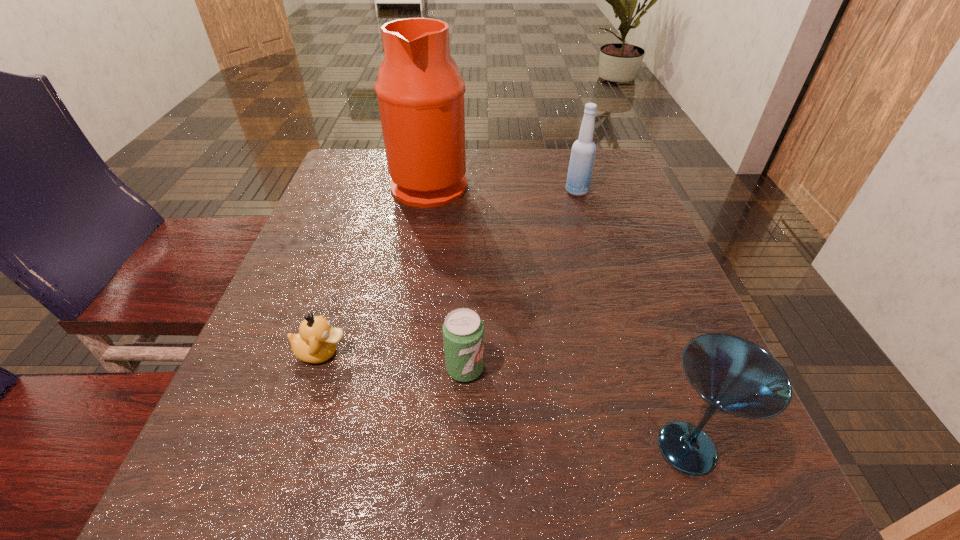
Image resolution: width=960 pixels, height=540 pixels. I want to click on free space located on the face of the shortest object, so click(x=385, y=352).

The height and width of the screenshot is (540, 960). In order to click on water jug that is at the far edge in this screenshot , I will do `click(420, 92)`.

Where is `bottle that is at the far edge`? The image size is (960, 540). bottle that is at the far edge is located at coordinates (583, 151).

Find the location of a particular element. object situated at the near edge is located at coordinates (734, 376).

Locate an element on the screen. This screenshot has width=960, height=540. water jug that is at the left edge is located at coordinates (420, 92).

This screenshot has height=540, width=960. Find the location of `duckling at the left edge`. duckling at the left edge is located at coordinates (316, 342).

The height and width of the screenshot is (540, 960). I want to click on bottle that is at the right edge, so click(x=583, y=151).

Where is `martini present at the right edge`? The width and height of the screenshot is (960, 540). martini present at the right edge is located at coordinates (734, 376).

In order to click on object present at the far left corner in this screenshot , I will do `click(420, 92)`.

Locate an element on the screen. object present at the far right corner is located at coordinates (583, 151).